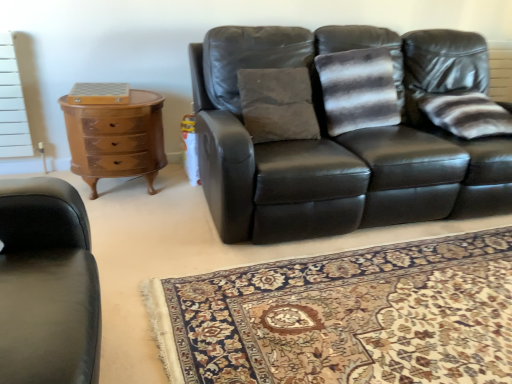
The width and height of the screenshot is (512, 384). Describe the element at coordinates (345, 316) in the screenshot. I see `carpet with intricate floral pattern at center` at that location.

What do you see at coordinates (339, 131) in the screenshot? I see `matte black leather couch at center` at bounding box center [339, 131].

What is the approximate width of striped fabric pillow at right?

18.63 inches.

The width and height of the screenshot is (512, 384). What do you see at coordinates (466, 114) in the screenshot? I see `striped fabric pillow at right` at bounding box center [466, 114].

Locate an element on the screen. carpet with intricate floral pattern at center is located at coordinates (345, 316).

Could you tell me if striped fabric pillow at right is turned towards wooden glossy chest of drawers at left?

No.

Is striped fabric pillow at right taller or shorter than wooden glossy chest of drawers at left?

Clearly, striped fabric pillow at right is shorter compared to wooden glossy chest of drawers at left.

Between striped fabric pillow at right and wooden glossy chest of drawers at left, which one has larger size?

With larger size is wooden glossy chest of drawers at left.

Is striped fabric pillow at right thinner than carpet with intricate floral pattern at center?

Indeed, striped fabric pillow at right has a lesser width compared to carpet with intricate floral pattern at center.

Is striped fabric pillow at right aimed at carpet with intricate floral pattern at center?

No.

Is striped fabric pillow at right spatially inside carpet with intricate floral pattern at center, or outside of it?

striped fabric pillow at right cannot be found inside carpet with intricate floral pattern at center.

Is striped fabric pillow at right a part of matte black leather couch at center?

Yes, matte black leather couch at center is surrounding striped fabric pillow at right.

Between matte black leather couch at center and striped fabric pillow at right, which one has larger size?

matte black leather couch at center.

From a real-world perspective, relative to striped fabric pillow at right, is matte black leather couch at center vertically above or below?

Clearly, from a real-world perspective, matte black leather couch at center is below striped fabric pillow at right.

Can you tell me how much matte black leather couch at center and striped fabric pillow at right differ in facing direction?

The angle between the facing direction of matte black leather couch at center and the facing direction of striped fabric pillow at right is 1.97 degrees.

Can you tell me how much matte black leather couch at center and wooden glossy chest of drawers at left differ in facing direction?

The angle between the facing direction of matte black leather couch at center and the facing direction of wooden glossy chest of drawers at left is 0.748 degrees.

From a real-world perspective, is matte black leather couch at center physically located above or below wooden glossy chest of drawers at left?

In terms of real-world spatial position, matte black leather couch at center is above wooden glossy chest of drawers at left.

Locate an element on the screen. The width and height of the screenshot is (512, 384). studio couch above the wooden glossy chest of drawers at left (from a real-world perspective) is located at coordinates (339, 131).

Consider the image. How distant is matte black leather couch at center from wooden glossy chest of drawers at left?

The distance of matte black leather couch at center from wooden glossy chest of drawers at left is 34.04 inches.

Who is smaller, carpet with intricate floral pattern at center or striped fabric pillow at right?

striped fabric pillow at right.

Would you say carpet with intricate floral pattern at center is a long distance from striped fabric pillow at right?

Absolutely, carpet with intricate floral pattern at center is distant from striped fabric pillow at right.

What's the angular difference between carpet with intricate floral pattern at center and striped fabric pillow at right's facing directions?

89 degrees.

Considering the points (504, 302) and (425, 107), which point is behind, point (504, 302) or point (425, 107)?

The point (425, 107) is behind.

Which is in front, point (154, 124) or point (488, 112)?

The point (154, 124) is closer to the camera.

Is striped fabric pillow at right completely or partially inside wooden glossy chest of drawers at left?

No, striped fabric pillow at right is not inside wooden glossy chest of drawers at left.

Looking at this image, is wooden glossy chest of drawers at left looking in the opposite direction of striped fabric pillow at right?

wooden glossy chest of drawers at left is not turned away from striped fabric pillow at right.

From the image's perspective, relative to carpet with intricate floral pattern at center, is wooden glossy chest of drawers at left above or below?

wooden glossy chest of drawers at left is above carpet with intricate floral pattern at center.

Which of these two, wooden glossy chest of drawers at left or carpet with intricate floral pattern at center, is bigger?

With larger size is wooden glossy chest of drawers at left.

Can you confirm if wooden glossy chest of drawers at left is positioned to the right of carpet with intricate floral pattern at center?

Incorrect, wooden glossy chest of drawers at left is not on the right side of carpet with intricate floral pattern at center.

Does wooden glossy chest of drawers at left turn towards carpet with intricate floral pattern at center?

No.

Locate an element on the screen. The image size is (512, 384). chest of drawers in front of the striped fabric pillow at right is located at coordinates (116, 138).

In order to click on mat that is below the striped fabric pillow at right (from the image's perspective) in this screenshot , I will do `click(345, 316)`.

Which object lies nearer to the anchor point matte black leather couch at center, striped fabric pillow at right or carpet with intricate floral pattern at center?

Result: Among the two, striped fabric pillow at right is located nearer to matte black leather couch at center.

Considering their positions, is striped fabric pillow at right positioned further to wooden glossy chest of drawers at left than matte black leather couch at center?

Among the two, striped fabric pillow at right is located further to wooden glossy chest of drawers at left.

Considering their positions, is wooden glossy chest of drawers at left positioned further to matte black leather couch at center than carpet with intricate floral pattern at center?

wooden glossy chest of drawers at left.

Estimate the real-world distances between objects in this image. Which object is further from carpet with intricate floral pattern at center, matte black leather couch at center or wooden glossy chest of drawers at left?

wooden glossy chest of drawers at left.

Estimate the real-world distances between objects in this image. Which object is further from wooden glossy chest of drawers at left, matte black leather couch at center or carpet with intricate floral pattern at center?

carpet with intricate floral pattern at center is further to wooden glossy chest of drawers at left.

Considering their positions, is carpet with intricate floral pattern at center positioned closer to matte black leather couch at center than wooden glossy chest of drawers at left?

The object closer to matte black leather couch at center is carpet with intricate floral pattern at center.

Looking at the image, which one is located closer to wooden glossy chest of drawers at left, striped fabric pillow at right or carpet with intricate floral pattern at center?

carpet with intricate floral pattern at center is positioned closer to the anchor wooden glossy chest of drawers at left.

From the image, which object appears to be nearer to striped fabric pillow at right, carpet with intricate floral pattern at center or wooden glossy chest of drawers at left?

carpet with intricate floral pattern at center.

Locate an element on the screen. The image size is (512, 384). studio couch located between wooden glossy chest of drawers at left and striped fabric pillow at right in the left-right direction is located at coordinates (339, 131).

Find the location of a particular element. The height and width of the screenshot is (384, 512). mat located between wooden glossy chest of drawers at left and striped fabric pillow at right in the left-right direction is located at coordinates (345, 316).

Find the location of a particular element. The height and width of the screenshot is (384, 512). mat situated between wooden glossy chest of drawers at left and matte black leather couch at center from left to right is located at coordinates (345, 316).

The image size is (512, 384). In order to click on studio couch positioned between carpet with intricate floral pattern at center and striped fabric pillow at right from near to far in this screenshot , I will do `click(339, 131)`.